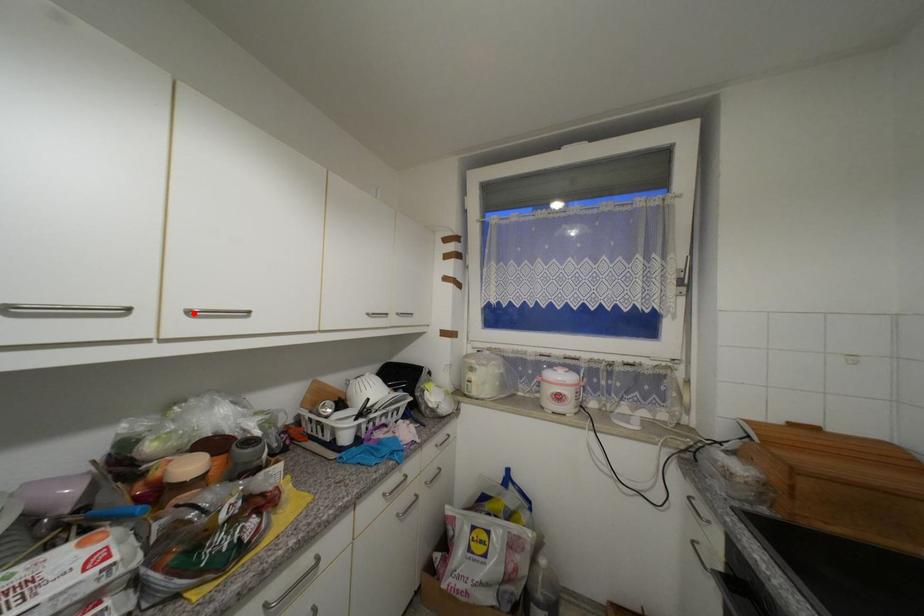
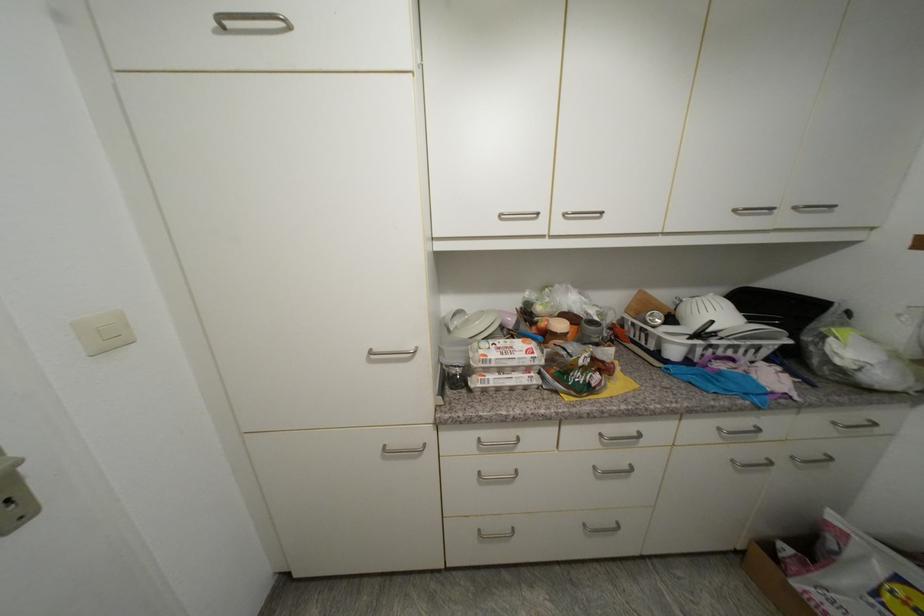
Where in the second image is the point corresponding to the highlighted location from the first image?

(570, 216)